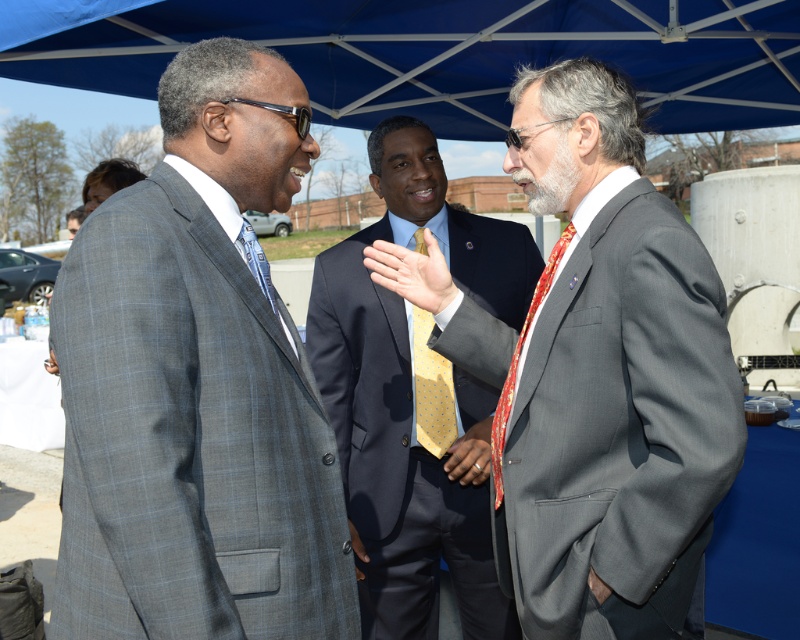
Is gray checkered suit at center taller than yellow dotted tie at center?

Indeed, gray checkered suit at center has a greater height compared to yellow dotted tie at center.

Does gray checkered suit at center appear on the right side of yellow dotted tie at center?

No, gray checkered suit at center is not to the right of yellow dotted tie at center.

The image size is (800, 640). In order to click on gray checkered suit at center in this screenshot , I will do `click(197, 385)`.

Locate an element on the screen. This screenshot has height=640, width=800. gray checkered suit at center is located at coordinates (197, 385).

Who is shorter, yellow dotted fabric tie at center or red silk tie at right?

red silk tie at right is shorter.

Between yellow dotted fabric tie at center and red silk tie at right, which one has more height?

With more height is yellow dotted fabric tie at center.

At what (x,y) coordinates should I click in order to perform the action: click on yellow dotted fabric tie at center. Please return your answer as a coordinate pair (x, y). The width and height of the screenshot is (800, 640). Looking at the image, I should click on coord(432,388).

Consider the image. Between blue fabric canopy at upper center and dark blue suit at center, which one has more height?

dark blue suit at center is taller.

Describe the element at coordinates (434, 52) in the screenshot. I see `blue fabric canopy at upper center` at that location.

What do you see at coordinates (434, 52) in the screenshot? I see `blue fabric canopy at upper center` at bounding box center [434, 52].

At what (x,y) coordinates should I click in order to perform the action: click on blue fabric canopy at upper center. Please return your answer as a coordinate pair (x, y). The width and height of the screenshot is (800, 640). Looking at the image, I should click on (434, 52).